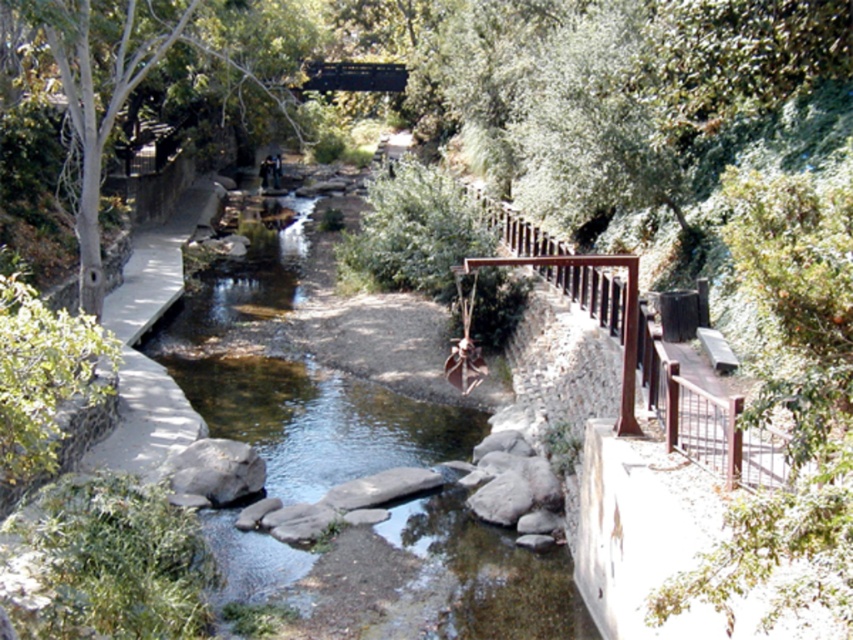
Question: Does green leafy tree at left lie behind metallic bridge at upper center?

Choices:
 (A) yes
 (B) no

Answer: (B)

Question: In this image, where is green leafy tree at left located relative to metallic bridge at upper center?

Choices:
 (A) left
 (B) right

Answer: (A)

Question: Is green leafy tree at left bigger than metallic bridge at upper center?

Choices:
 (A) yes
 (B) no

Answer: (A)

Question: Which point is farther to the camera?

Choices:
 (A) metallic bridge at upper center
 (B) green leafy tree at left

Answer: (A)

Question: Which object appears closest to the camera in this image?

Choices:
 (A) green leafy tree at left
 (B) metallic bridge at upper center

Answer: (A)